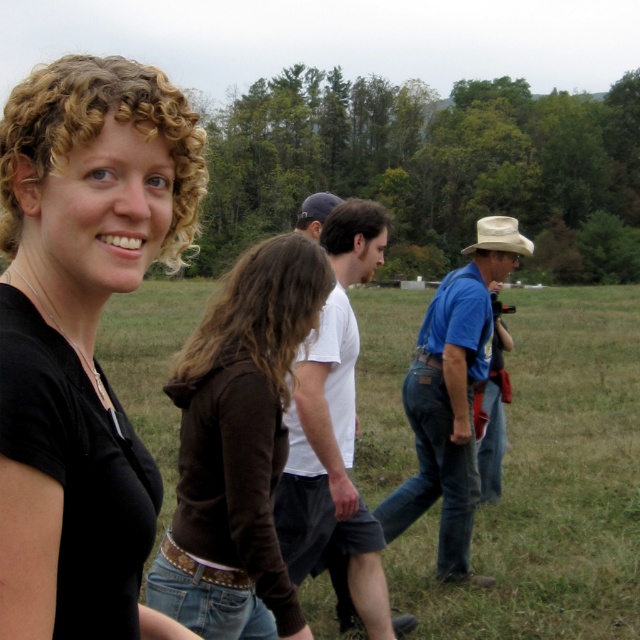
Can you confirm if white matte cowboy hat at upper right is shorter than dark blue baseball cap at center?

Correct, white matte cowboy hat at upper right is not as tall as dark blue baseball cap at center.

Who is more distant from viewer, (497,240) or (333,202)?

The point (333,202) is more distant.

Locate an element on the screen. The height and width of the screenshot is (640, 640). white matte cowboy hat at upper right is located at coordinates (499, 236).

Who is higher up, white cotton t-shirt at center or dark blue baseball cap at center?

dark blue baseball cap at center is higher up.

Does point (365, 536) lie in front of point (326, 208)?

Yes, point (365, 536) is closer to viewer.

Locate an element on the screen. The image size is (640, 640). white cotton t-shirt at center is located at coordinates (333, 433).

I want to click on white cotton t-shirt at center, so click(333, 433).

How far apart are brown cotton shirt at center and white cotton t-shirt at center?

brown cotton shirt at center is 4.20 feet away from white cotton t-shirt at center.

Who is more distant from viewer, (269, 257) or (292, 499)?

Positioned behind is point (292, 499).

I want to click on brown cotton shirt at center, so click(x=244, y=413).